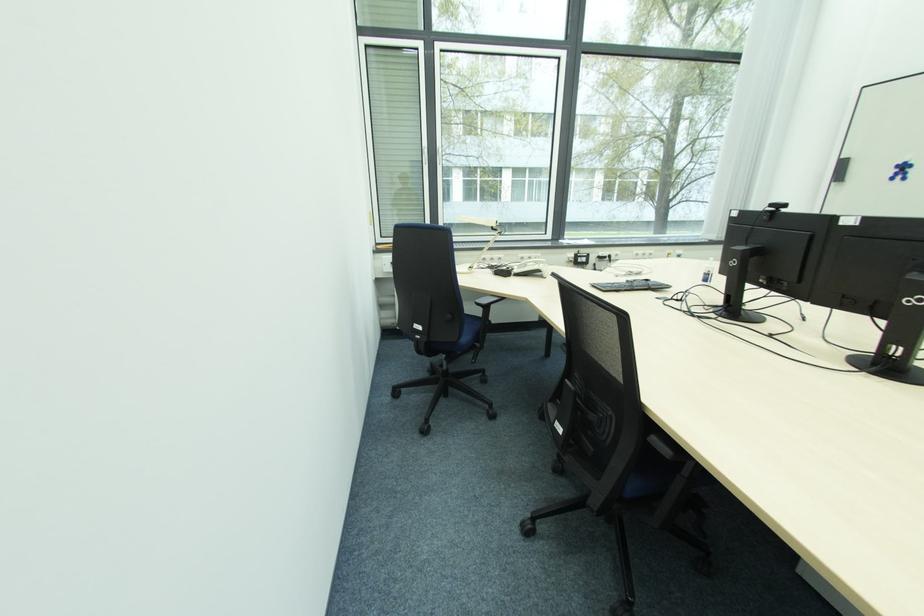
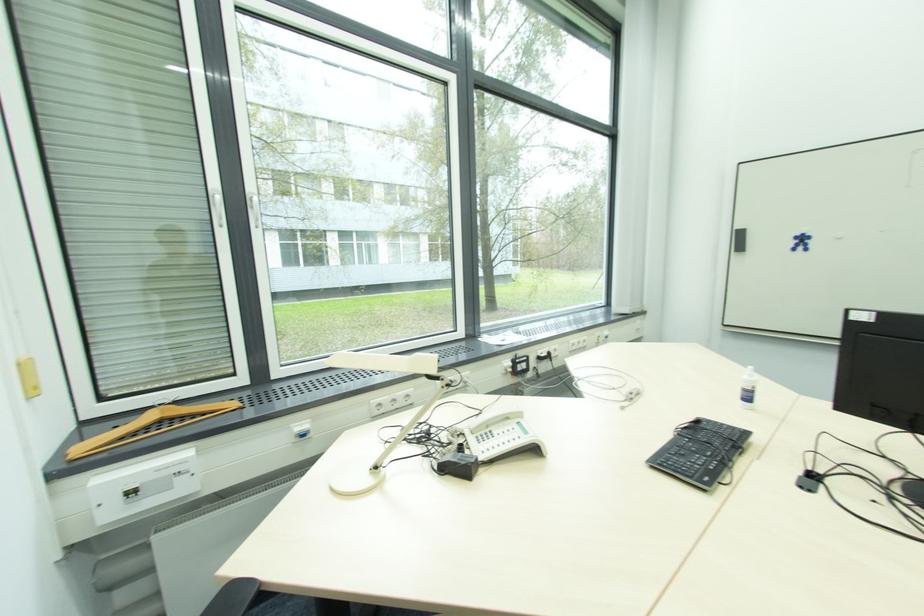
The point at (429, 153) is marked in the first image. Where is the corresponding point in the second image?

(223, 200)